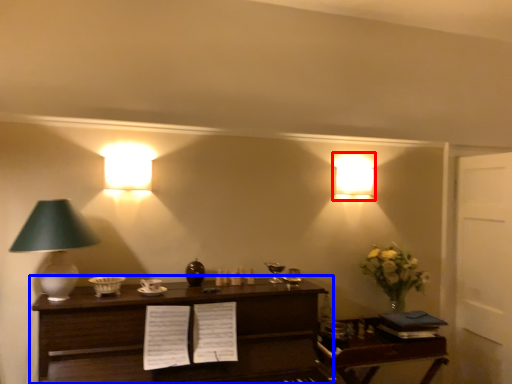
Question: Which point is closer to the camera, lamp (highlighted by a red box) or table (highlighted by a blue box)?

Choices:
 (A) lamp
 (B) table

Answer: (B)